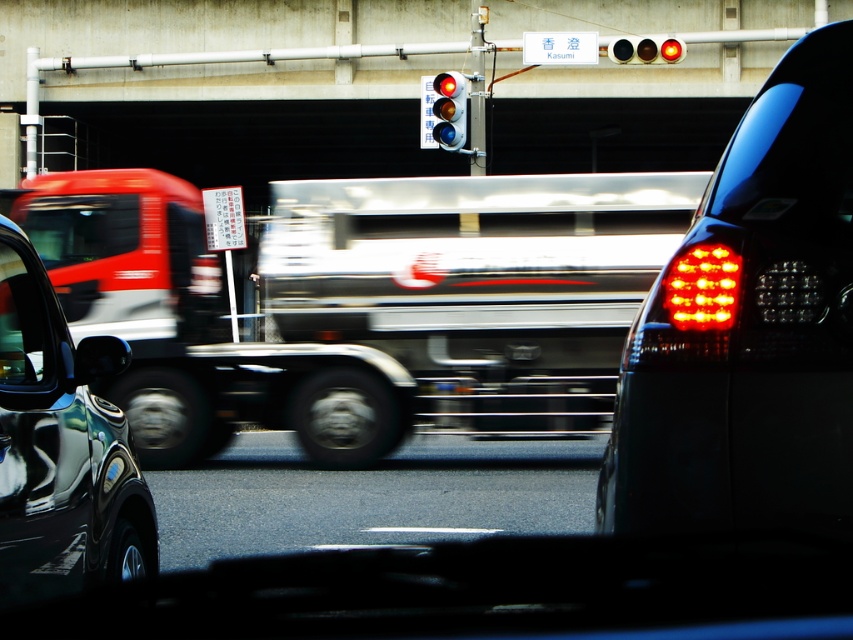
You are a passenger in a car and looking through the windshield. You see the shiny black car at left and the matte glass traffic light at upper center. Which object is closer to you?

The shiny black car at left is closer to you because it is located below the matte glass traffic light at upper center, indicating it is in the foreground.

You are a pedestrian standing on the sidewalk and want to cross the street. You see the asphalt at center and the red glass traffic light at upper center. Which object is closer to your left side?

The asphalt at center is to the left of red glass traffic light at upper center, so the asphalt at center is closer to your left side.